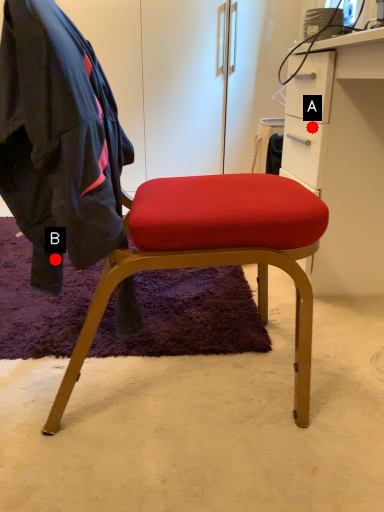
Question: Two points are circled on the image, labeled by A and B beside each circle. Among these points, which one is farthest from the camera?

Choices:
 (A) A is further
 (B) B is further

Answer: (A)